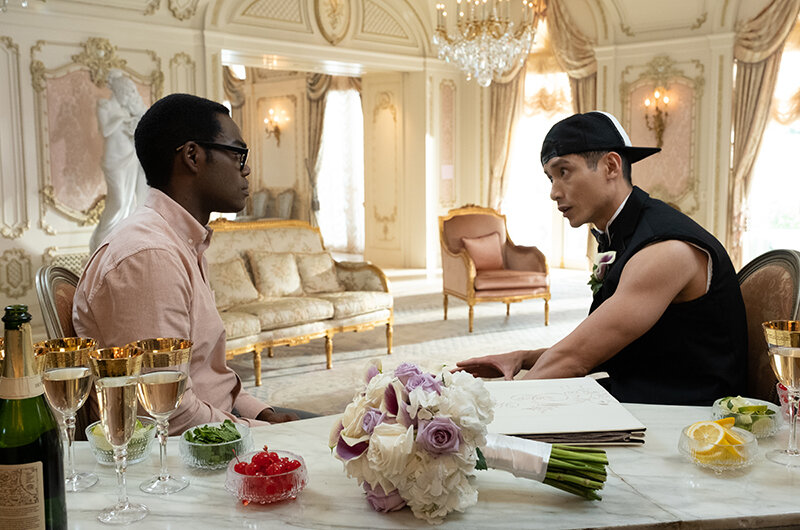
Identify the location of statue. The height and width of the screenshot is (530, 800). (118, 135).